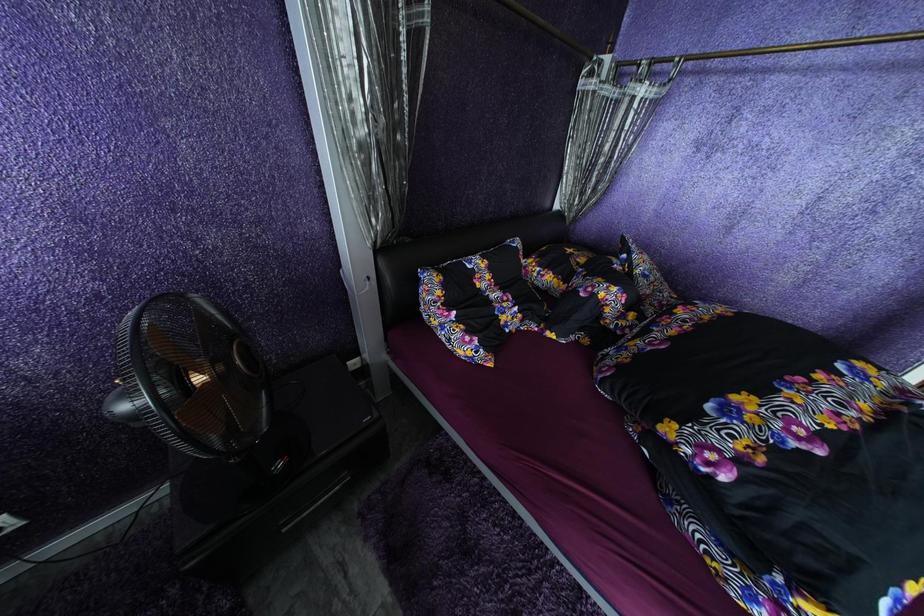
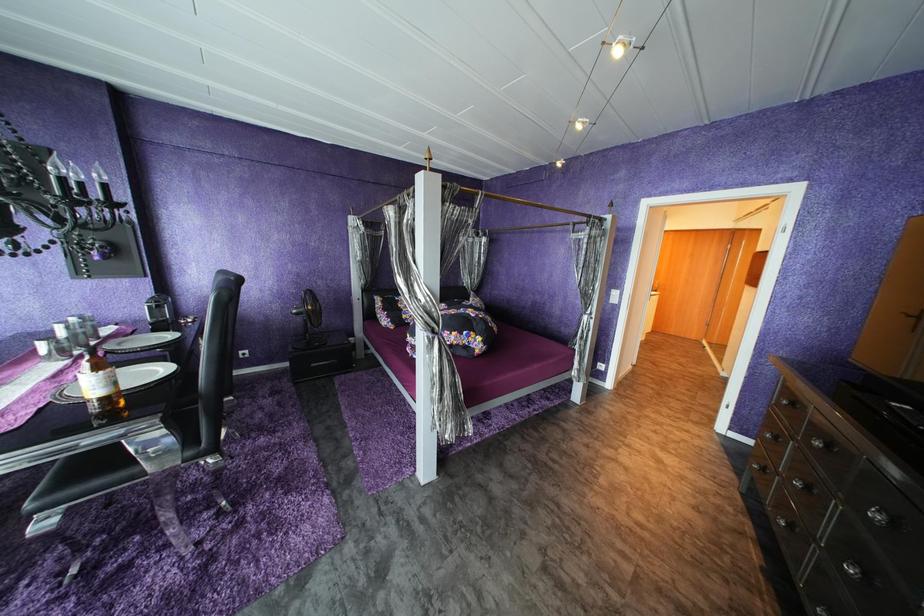
What movement of the cameraman would produce the second image?

The movement direction of the cameraman is right, backward.